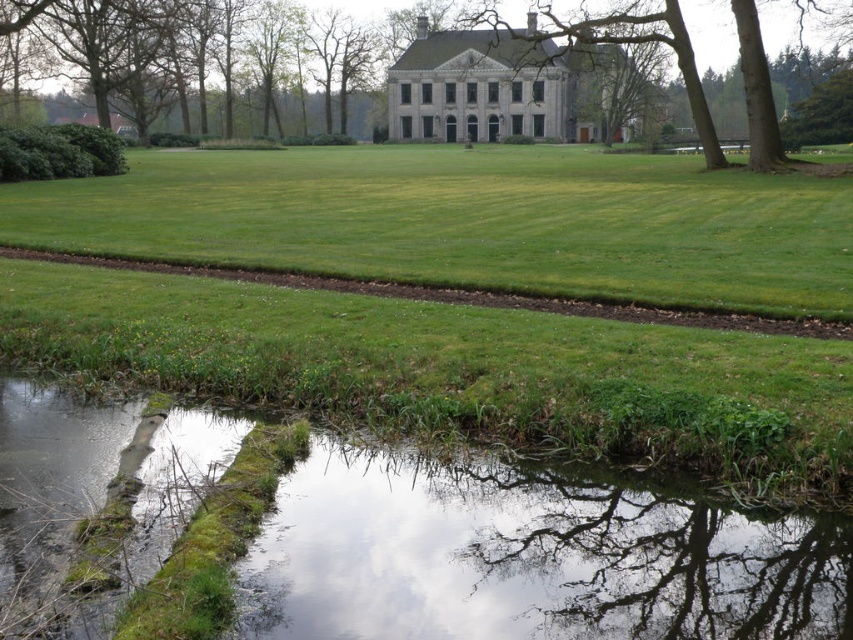
Question: Does green grass at lower center appear on the left side of brown textured tree at center?

Choices:
 (A) yes
 (B) no

Answer: (A)

Question: Which point is closer to the camera?

Choices:
 (A) (393, 273)
 (B) (640, 13)

Answer: (A)

Question: Among these points, which one is farthest from the camera?

Choices:
 (A) (605, 250)
 (B) (708, 164)

Answer: (B)

Question: Where is green grass at lower center located in relation to brown textured tree at center in the image?

Choices:
 (A) right
 (B) left

Answer: (B)

Question: Can you confirm if green grass at lower center is bigger than brown textured tree at center?

Choices:
 (A) no
 (B) yes

Answer: (A)